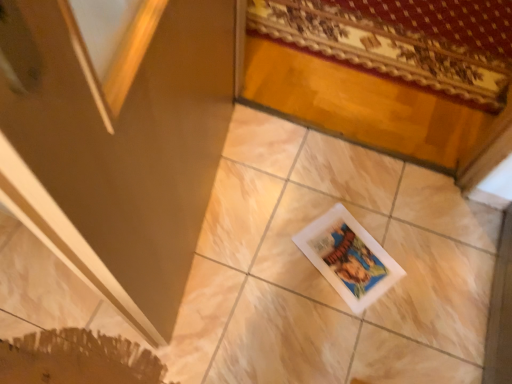
Question: Can you confirm if patterned fabric mat at upper right is positioned to the left of matte brown screen door at lower left?

Choices:
 (A) yes
 (B) no

Answer: (B)

Question: From a real-world perspective, is patterned fabric mat at upper right on matte brown screen door at lower left?

Choices:
 (A) yes
 (B) no

Answer: (B)

Question: Is patterned fabric mat at upper right oriented away from matte brown screen door at lower left?

Choices:
 (A) yes
 (B) no

Answer: (B)

Question: Does patterned fabric mat at upper right have a greater height compared to matte brown screen door at lower left?

Choices:
 (A) yes
 (B) no

Answer: (B)

Question: Is patterned fabric mat at upper right positioned behind matte brown screen door at lower left?

Choices:
 (A) no
 (B) yes

Answer: (B)

Question: Based on their positions, is patterned fabric mat at upper right located to the left or right of matte brown screen door at lower left?

Choices:
 (A) left
 (B) right

Answer: (B)

Question: Is patterned fabric mat at upper right in front of or behind matte brown screen door at lower left in the image?

Choices:
 (A) front
 (B) behind

Answer: (B)

Question: From the image's perspective, is patterned fabric mat at upper right positioned above or below matte brown screen door at lower left?

Choices:
 (A) above
 (B) below

Answer: (A)

Question: In terms of height, does patterned fabric mat at upper right look taller or shorter compared to matte brown screen door at lower left?

Choices:
 (A) short
 (B) tall

Answer: (A)

Question: Considering the positions of point (399, 276) and point (110, 269), is point (399, 276) closer or farther from the camera than point (110, 269)?

Choices:
 (A) closer
 (B) farther

Answer: (B)

Question: From the image's perspective, is white matte picture frame at center positioned above or below matte brown screen door at lower left?

Choices:
 (A) below
 (B) above

Answer: (A)

Question: Is white matte picture frame at center to the left or to the right of matte brown screen door at lower left in the image?

Choices:
 (A) left
 (B) right

Answer: (B)

Question: Is white matte picture frame at center wider or thinner than matte brown screen door at lower left?

Choices:
 (A) thin
 (B) wide

Answer: (B)

Question: In terms of height, does matte brown screen door at lower left look taller or shorter compared to white matte picture frame at center?

Choices:
 (A) tall
 (B) short

Answer: (A)

Question: Visually, is matte brown screen door at lower left positioned to the left or to the right of white matte picture frame at center?

Choices:
 (A) right
 (B) left

Answer: (B)